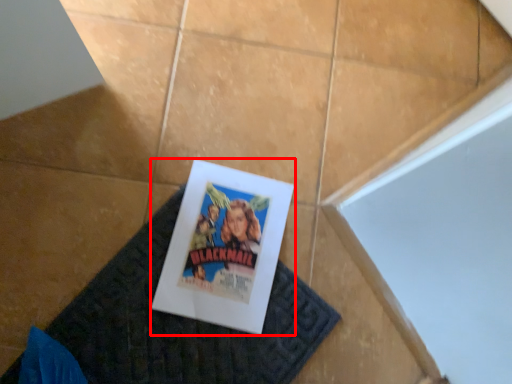
Question: From the image's perspective, where is poster (annotated by the red box) located in relation to doormat in the image?

Choices:
 (A) above
 (B) below

Answer: (A)